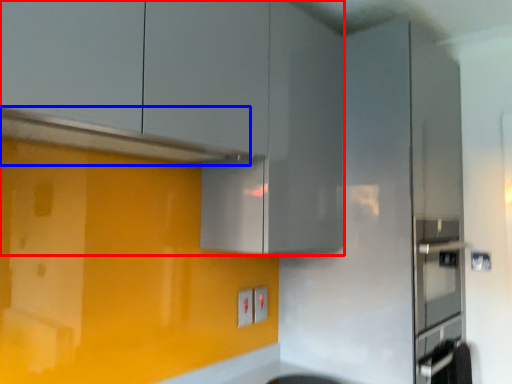
Question: Which of the following is the closest to the observer, cabinetry (highlighted by a red box) or exhaust hood (highlighted by a blue box)?

Choices:
 (A) cabinetry
 (B) exhaust hood

Answer: (A)